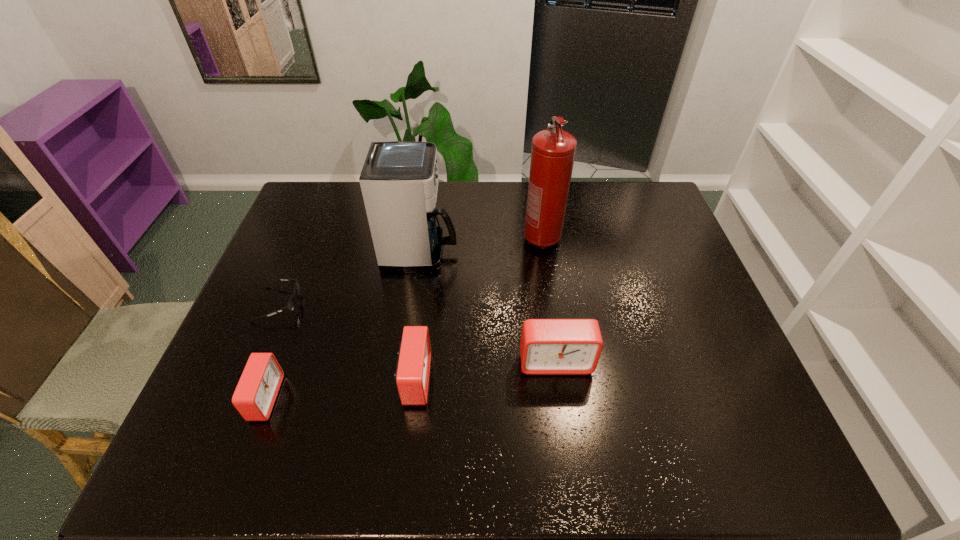
Image resolution: width=960 pixels, height=540 pixels. What are the coordinates of `empty space that is in between the second alarm clock from right to left and the shortest object` in the screenshot? It's located at (347, 342).

The image size is (960, 540). In order to click on free area in between the second alarm clock from left to right and the fire extinguisher in this screenshot , I will do `click(478, 309)`.

The image size is (960, 540). I want to click on the fifth closest object to the second shortest object, so click(553, 151).

Locate an element on the screen. The height and width of the screenshot is (540, 960). object that can be found as the closest to the tallest object is located at coordinates (399, 181).

Choose which alarm clock is the nearest neighbor to the fourth tallest object. Please provide its 2D coordinates. Your answer should be formatted as a tuple, i.e. [(x, y)], where the tuple contains the x and y coordinates of a point satisfying the conditions above.

[(548, 346)]

Locate an element on the screen. The image size is (960, 540). alarm clock that is the second closest to the rightmost alarm clock is located at coordinates (254, 397).

Locate an element on the screen. The height and width of the screenshot is (540, 960). vacant region that satisfies the following two spatial constraints: 1. on the front-facing side of the rightmost alarm clock; 2. on the front-facing side of the second shortest object is located at coordinates (561, 398).

Where is `vacant region that satisfies the following two spatial constraints: 1. on the handle side the fire extinguisher; 2. on the front-facing side of the leftmost alarm clock`? The image size is (960, 540). vacant region that satisfies the following two spatial constraints: 1. on the handle side the fire extinguisher; 2. on the front-facing side of the leftmost alarm clock is located at coordinates (565, 398).

Where is `free point that satisfies the following two spatial constraints: 1. on the handle side the tallest object; 2. on the front-facing side of the fourth nearest object`? This screenshot has width=960, height=540. free point that satisfies the following two spatial constraints: 1. on the handle side the tallest object; 2. on the front-facing side of the fourth nearest object is located at coordinates (551, 304).